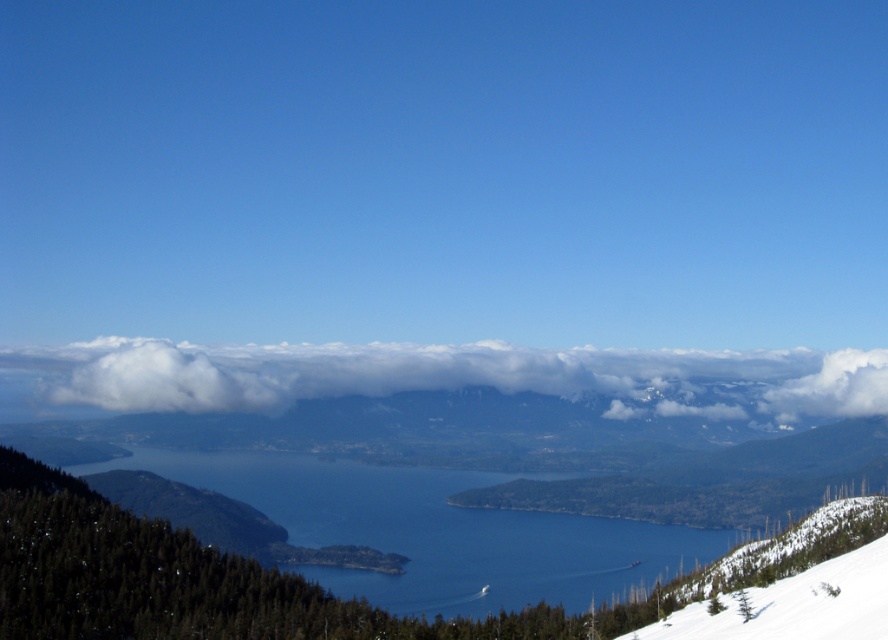
You are an airplane pilot flying over the landscape and need to determine the distance between the white fluffy cloud at upper center and the blue water at center. Which one is closer to your current position?

The white fluffy cloud at upper center is closer to your current position because it is further to the viewer than the blue water at center.

You are standing at the viewpoint overlooking the lake and want to take a photo. You notice two points marked on your map corresponding to coordinates in the scene. The first point is at point (865, 372) and the second is at point (536, 525). Which point is closer to your current position?

Point (865, 372) is further to the camera than point (536, 525), so the closer point to your current position is point (536, 525).

You are a photographer planning to capture the reflection of the white fluffy cloud at upper center in the blue water at center. Given that the reflection requires the cloud to be within 500 feet of the water, will you be able to achieve this reflection?

The distance between the white fluffy cloud at upper center and the blue water at center is 616.45 feet, which exceeds the 500 feet requirement. Therefore, the reflection may not be visible as the cloud is too far away.